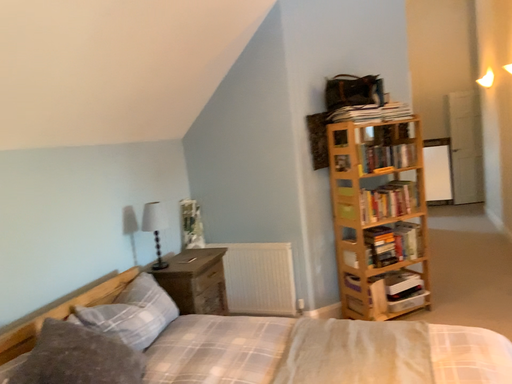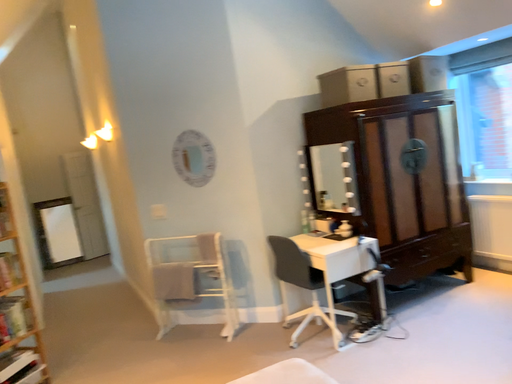
Question: Which way did the camera rotate in the video?

Choices:
 (A) rotated left
 (B) rotated right

Answer: (B)